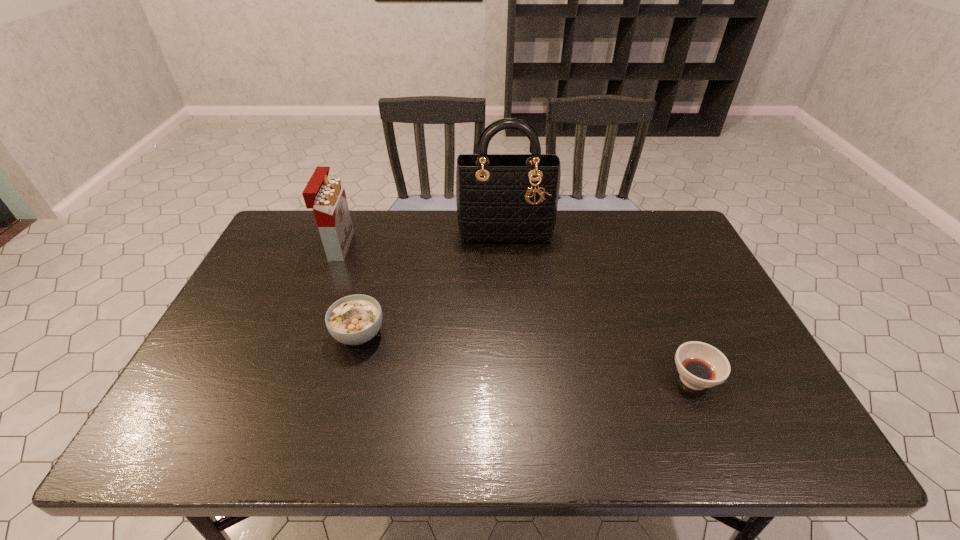
The width and height of the screenshot is (960, 540). I want to click on empty space that is in between the left soup bowl and the handbag, so click(x=432, y=283).

I want to click on vacant area that lies between the second object from left to right and the shortest object, so click(x=526, y=356).

Locate an element on the screen. This screenshot has width=960, height=540. object that is the second closest to the third tallest object is located at coordinates (504, 198).

Identify which object is the closest to the leftmost object. Please provide its 2D coordinates. Your answer should be formatted as a tuple, i.e. [(x, y)], where the tuple contains the x and y coordinates of a point satisfying the conditions above.

[(355, 319)]

You are a GUI agent. You are given a task and a screenshot of the screen. Output one action in this format:
    pyautogui.click(x=<x>, y=<y>)
    Task: Click on the free spot that satisfies the following two spatial constraints: 1. at the front of the tallest object with visible charms; 2. with the lid open on the cigarette case
    This screenshot has width=960, height=540.
    Given the screenshot: What is the action you would take?
    pyautogui.click(x=507, y=246)

Locate an element on the screen. Image resolution: width=960 pixels, height=540 pixels. blank space that satisfies the following two spatial constraints: 1. on the back side of the second object from left to right; 2. with the lid open on the third shortest object is located at coordinates (382, 246).

This screenshot has height=540, width=960. I want to click on free space that satisfies the following two spatial constraints: 1. on the back side of the right soup bowl; 2. with the lid open on the cigarette case, so click(x=636, y=246).

Find the location of a particular element. This screenshot has height=540, width=960. free spot that satisfies the following two spatial constraints: 1. with the lid open on the third shortest object; 2. on the back side of the third farthest object is located at coordinates (305, 334).

Where is `vacant region that satisfies the following two spatial constraints: 1. at the front of the tallest object with visible charms; 2. on the right side of the nearest object`? vacant region that satisfies the following two spatial constraints: 1. at the front of the tallest object with visible charms; 2. on the right side of the nearest object is located at coordinates (516, 379).

The height and width of the screenshot is (540, 960). What are the coordinates of `free point that satisfies the following two spatial constraints: 1. on the back side of the shortest object; 2. with the lid open on the leftmost object` in the screenshot? It's located at (x=636, y=246).